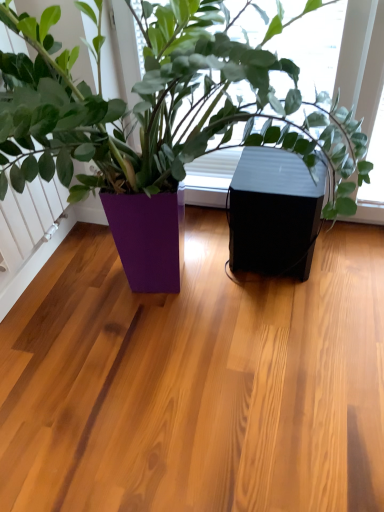
What is the approximate width of black matte speaker at center?

15.89 inches.

The height and width of the screenshot is (512, 384). Identify the location of black matte speaker at center. (273, 213).

This screenshot has width=384, height=512. Describe the element at coordinates (273, 213) in the screenshot. I see `black matte speaker at center` at that location.

This screenshot has height=512, width=384. What do you see at coordinates (163, 106) in the screenshot? I see `purple glossy planter at center` at bounding box center [163, 106].

Locate an element on the screen. purple glossy planter at center is located at coordinates (163, 106).

Identify the location of black matte speaker at center. (273, 213).

Which object is positioned more to the right, purple glossy planter at center or black matte speaker at center?

black matte speaker at center.

Considering the relative positions of purple glossy planter at center and black matte speaker at center in the image provided, is purple glossy planter at center behind black matte speaker at center?

No, purple glossy planter at center is closer to the viewer.

Which is in front, point (207, 12) or point (277, 203)?

The point (207, 12) is closer to the camera.

From the image's perspective, is purple glossy planter at center above black matte speaker at center?

Yes, from the image's perspective, purple glossy planter at center is on top of black matte speaker at center.

Based on the photo, from a real-world perspective, which is physically below, purple glossy planter at center or black matte speaker at center?

From a 3D spatial view, black matte speaker at center is below.

Which object is thinner, purple glossy planter at center or black matte speaker at center?

Thinner between the two is black matte speaker at center.

Who is shorter, purple glossy planter at center or black matte speaker at center?

With less height is black matte speaker at center.

Based on the photo, considering the sizes of objects purple glossy planter at center and black matte speaker at center in the image provided, who is smaller, purple glossy planter at center or black matte speaker at center?

Smaller between the two is black matte speaker at center.

Is purple glossy planter at center not within black matte speaker at center?

purple glossy planter at center is positioned outside black matte speaker at center.

Are purple glossy planter at center and black matte speaker at center located far from each other?

No, purple glossy planter at center is not far away from black matte speaker at center.

Is purple glossy planter at center oriented towards black matte speaker at center?

No, purple glossy planter at center is not turned towards black matte speaker at center.

How different are the orientations of purple glossy planter at center and black matte speaker at center in degrees?

0.000353 degrees.

How far apart are purple glossy planter at center and black matte speaker at center?

purple glossy planter at center is 14.68 inches from black matte speaker at center.

At what (x,y) coordinates should I click in order to perform the action: click on houseplant lying on the left of black matte speaker at center. Please return your answer as a coordinate pair (x, y). The image size is (384, 512). Looking at the image, I should click on (163, 106).

Is black matte speaker at center to the right of purple glossy planter at center from the viewer's perspective?

Indeed, black matte speaker at center is positioned on the right side of purple glossy planter at center.

Relative to purple glossy planter at center, is black matte speaker at center in front or behind?

black matte speaker at center is positioned farther from the viewer than purple glossy planter at center.

Considering the points (303, 168) and (105, 156), which point is behind, point (303, 168) or point (105, 156)?

Point (303, 168)

From the image's perspective, is black matte speaker at center positioned above or below purple glossy planter at center?

Based on their image positions, black matte speaker at center is located beneath purple glossy planter at center.

From a real-world perspective, is black matte speaker at center beneath purple glossy planter at center?

Correct, in the physical world, black matte speaker at center is lower than purple glossy planter at center.

Does black matte speaker at center have a greater width compared to purple glossy planter at center?

No, black matte speaker at center is not wider than purple glossy planter at center.

Between black matte speaker at center and purple glossy planter at center, which one has more height?

purple glossy planter at center.

Who is smaller, black matte speaker at center or purple glossy planter at center?

Smaller between the two is black matte speaker at center.

Can purple glossy planter at center be found inside black matte speaker at center?

No, purple glossy planter at center is located outside of black matte speaker at center.

Is black matte speaker at center touching purple glossy planter at center?

No, black matte speaker at center is not making contact with purple glossy planter at center.

Could you tell me if black matte speaker at center is facing purple glossy planter at center?

Yes, black matte speaker at center is turned towards purple glossy planter at center.

You are a GUI agent. You are given a task and a screenshot of the screen. Output one action in this format:
    pyautogui.click(x=<x>, y=<y>)
    Task: Click on the window box lying below the purple glossy planter at center (from the image's perspective)
    This screenshot has height=512, width=384.
    Given the screenshot: What is the action you would take?
    pyautogui.click(x=273, y=213)

This screenshot has height=512, width=384. Find the location of `window box that appears behind the purple glossy planter at center`. window box that appears behind the purple glossy planter at center is located at coordinates pos(273,213).

You are a GUI agent. You are given a task and a screenshot of the screen. Output one action in this format:
    pyautogui.click(x=<x>, y=<y>)
    Task: Click on the houseplant in front of the black matte speaker at center
    
    Given the screenshot: What is the action you would take?
    pyautogui.click(x=163, y=106)